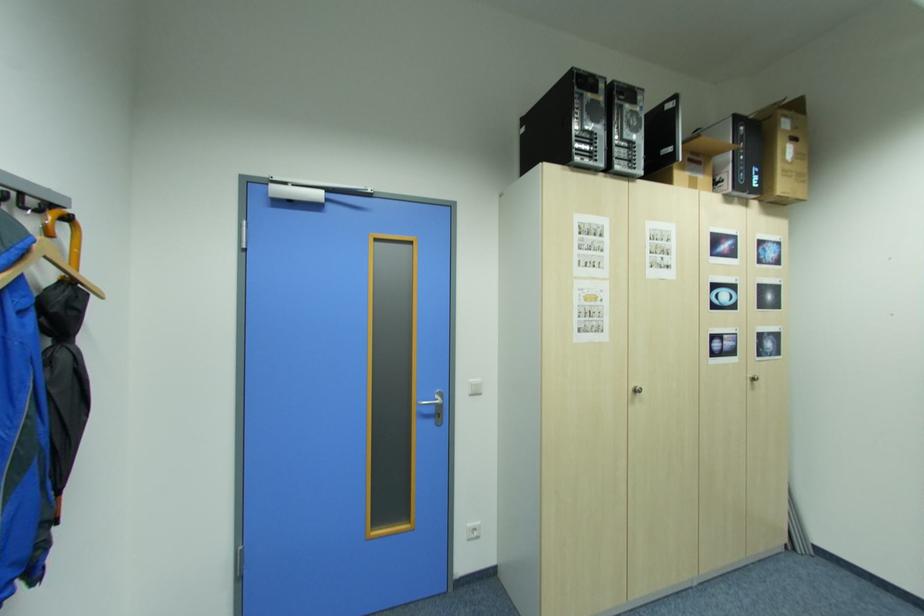
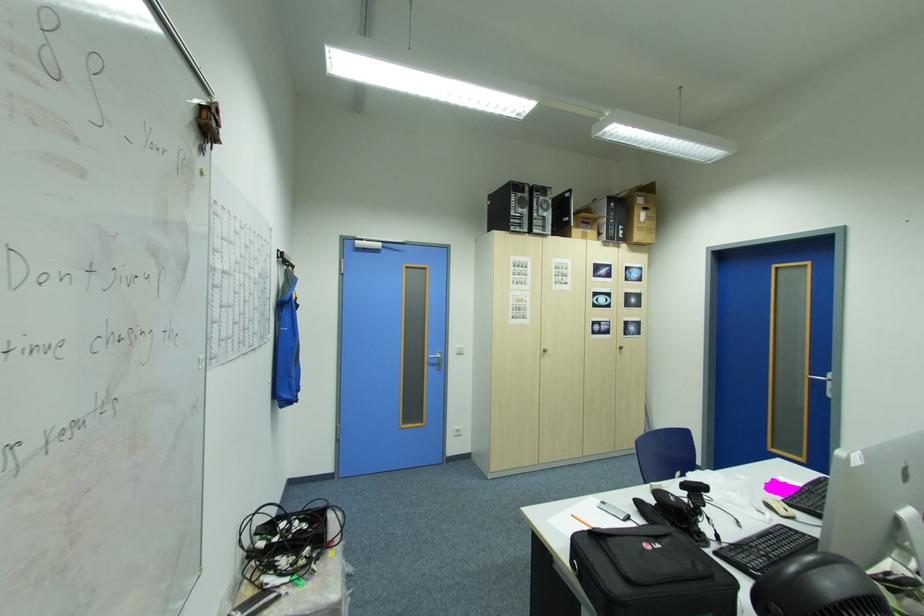
Find the pixel in the second image that matches point (598, 126) in the first image.

(527, 212)